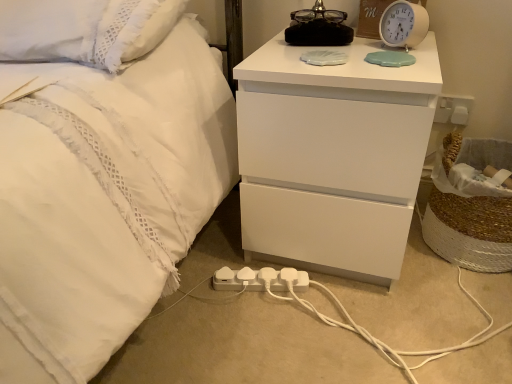
What do you see at coordinates (332, 156) in the screenshot? I see `white matte nightstand at upper right` at bounding box center [332, 156].

Image resolution: width=512 pixels, height=384 pixels. I want to click on white matte nightstand at upper right, so click(x=332, y=156).

Identify the location of woven straw laundry basket at lower right. (470, 206).

In the scene shown: Measure the distance between point (x=410, y=19) and camera.

Point (x=410, y=19) and camera are 36.97 inches apart from each other.

At what (x,y) coordinates should I click in order to perform the action: click on white plastic extension cord at lower center. Please return your answer as a coordinate pair (x, y). Looking at the image, I should click on (259, 280).

Could you tell me if white plastic extension cord at lower center is turned towards white matte nightstand at upper right?

No, white plastic extension cord at lower center does not turn towards white matte nightstand at upper right.

Considering the positions of objects white plastic extension cord at lower center and white matte nightstand at upper right in the image provided, who is more to the left, white plastic extension cord at lower center or white matte nightstand at upper right?

Positioned to the left is white plastic extension cord at lower center.

Is white plastic extension cord at lower center wider than white matte nightstand at upper right?

No, white plastic extension cord at lower center is not wider than white matte nightstand at upper right.

Can you confirm if white plastic extension cord at lower center is taller than white matte nightstand at upper right?

No, white plastic extension cord at lower center is not taller than white matte nightstand at upper right.

Considering the positions of point (365, 122) and point (413, 20), is point (365, 122) closer or farther from the camera than point (413, 20)?

Point (365, 122) is positioned closer to the camera compared to point (413, 20).

Can you tell me how much white matte nightstand at upper right and white plastic alarm clock at upper right differ in facing direction?

The angular difference between white matte nightstand at upper right and white plastic alarm clock at upper right is 32.2 degrees.

Between white matte nightstand at upper right and white plastic alarm clock at upper right, which one has smaller width?

Thinner between the two is white plastic alarm clock at upper right.

Can you confirm if white matte nightstand at upper right is positioned to the left of white plastic alarm clock at upper right?

Indeed, white matte nightstand at upper right is positioned on the left side of white plastic alarm clock at upper right.

Is white plastic extension cord at lower center oriented towards white plastic alarm clock at upper right?

No, white plastic extension cord at lower center is not facing towards white plastic alarm clock at upper right.

From a real-world perspective, relative to white plastic alarm clock at upper right, is white plastic extension cord at lower center vertically above or below?

From a real-world perspective, white plastic extension cord at lower center is physically below white plastic alarm clock at upper right.

Identify the location of extension cord that is on the left side of white plastic alarm clock at upper right. (259, 280).

Is white plastic extension cord at lower center positioned behind white plastic alarm clock at upper right?

Yes, it is behind white plastic alarm clock at upper right.

Can you confirm if white plastic alarm clock at upper right is shorter than white plastic extension cord at lower center?

No.

From the image's perspective, is white plastic alarm clock at upper right above or below white plastic extension cord at lower center?

white plastic alarm clock at upper right is situated higher than white plastic extension cord at lower center in the image.

Is white plastic alarm clock at upper right oriented away from white plastic extension cord at lower center?

white plastic alarm clock at upper right is not turned away from white plastic extension cord at lower center.

Which is more distant, (398,3) or (251,271)?

The point (251,271) is farther.

In terms of size, does woven straw laundry basket at lower right appear bigger or smaller than white matte nightstand at upper right?

Clearly, woven straw laundry basket at lower right is smaller in size than white matte nightstand at upper right.

From the image's perspective, which one is positioned higher, woven straw laundry basket at lower right or white matte nightstand at upper right?

white matte nightstand at upper right, from the image's perspective.

Is woven straw laundry basket at lower right wider than white matte nightstand at upper right?

No, woven straw laundry basket at lower right is not wider than white matte nightstand at upper right.

In terms of height, does woven straw laundry basket at lower right look taller or shorter compared to white matte nightstand at upper right?

Considering their sizes, woven straw laundry basket at lower right has less height than white matte nightstand at upper right.

Based on the photo, is woven straw laundry basket at lower right completely or partially inside white matte nightstand at upper right?

Actually, woven straw laundry basket at lower right is outside white matte nightstand at upper right.

What's the angular difference between white matte nightstand at upper right and woven straw laundry basket at lower right's facing directions?

2.74 degrees separate the facing orientations of white matte nightstand at upper right and woven straw laundry basket at lower right.

Which is more to the left, white matte nightstand at upper right or woven straw laundry basket at lower right?

white matte nightstand at upper right.

From a real-world perspective, who is located lower, white matte nightstand at upper right or woven straw laundry basket at lower right?

From a 3D spatial view, woven straw laundry basket at lower right is below.

From the picture: From a real-world perspective, who is located lower, white plastic alarm clock at upper right or white matte nightstand at upper right?

white matte nightstand at upper right is physically lower.

How different are the orientations of white plastic alarm clock at upper right and white matte nightstand at upper right in degrees?

The facing directions of white plastic alarm clock at upper right and white matte nightstand at upper right are 32.2 degrees apart.

Find the location of a particular element. This screenshot has width=512, height=384. alarm clock above the white matte nightstand at upper right (from a real-world perspective) is located at coordinates (403, 24).

Looking at this image, is white plastic alarm clock at upper right positioned far away from white matte nightstand at upper right?

No, white plastic alarm clock at upper right is in close proximity to white matte nightstand at upper right.

Where is `extension cord below the white matte nightstand at upper right (from a real-world perspective)`? extension cord below the white matte nightstand at upper right (from a real-world perspective) is located at coordinates (259, 280).

You are a GUI agent. You are given a task and a screenshot of the screen. Output one action in this format:
    pyautogui.click(x=<x>, y=<y>)
    Task: Click on the alarm clock on the right of white matte nightstand at upper right
    
    Given the screenshot: What is the action you would take?
    pyautogui.click(x=403, y=24)

When comparing their distances from white plastic alarm clock at upper right, does woven straw laundry basket at lower right or white matte nightstand at upper right seem further?

Among the two, woven straw laundry basket at lower right is located further to white plastic alarm clock at upper right.

Which object lies further to the anchor point white matte nightstand at upper right, white plastic extension cord at lower center or white plastic alarm clock at upper right?

Among the two, white plastic alarm clock at upper right is located further to white matte nightstand at upper right.

Considering their positions, is white matte nightstand at upper right positioned further to white plastic extension cord at lower center than woven straw laundry basket at lower right?

woven straw laundry basket at lower right lies further to white plastic extension cord at lower center than the other object.

Based on their spatial positions, is white plastic extension cord at lower center or white plastic alarm clock at upper right closer to woven straw laundry basket at lower right?

white plastic alarm clock at upper right is closer to woven straw laundry basket at lower right.

Which object lies nearer to the anchor point woven straw laundry basket at lower right, white plastic alarm clock at upper right or white plastic extension cord at lower center?

white plastic alarm clock at upper right is closer to woven straw laundry basket at lower right.

Looking at the image, which one is located closer to woven straw laundry basket at lower right, white plastic extension cord at lower center or white matte nightstand at upper right?

Among the two, white matte nightstand at upper right is located nearer to woven straw laundry basket at lower right.

Considering their positions, is woven straw laundry basket at lower right positioned closer to white plastic extension cord at lower center than white plastic alarm clock at upper right?

woven straw laundry basket at lower right is positioned closer to the anchor white plastic extension cord at lower center.

Looking at the image, which one is located further to white matte nightstand at upper right, white plastic extension cord at lower center or woven straw laundry basket at lower right?

Among the two, woven straw laundry basket at lower right is located further to white matte nightstand at upper right.

Find the location of a particular element. The height and width of the screenshot is (384, 512). alarm clock between white plastic extension cord at lower center and woven straw laundry basket at lower right is located at coordinates click(x=403, y=24).

Where is `alarm clock between white matte nightstand at upper right and woven straw laundry basket at lower right in the horizontal direction`? The height and width of the screenshot is (384, 512). alarm clock between white matte nightstand at upper right and woven straw laundry basket at lower right in the horizontal direction is located at coordinates (403, 24).

Where is `nightstand located between white plastic extension cord at lower center and woven straw laundry basket at lower right in the left-right direction`? nightstand located between white plastic extension cord at lower center and woven straw laundry basket at lower right in the left-right direction is located at coordinates (332, 156).

Identify the location of nightstand between white plastic alarm clock at upper right and white plastic extension cord at lower center in the up-down direction. The image size is (512, 384). (332, 156).